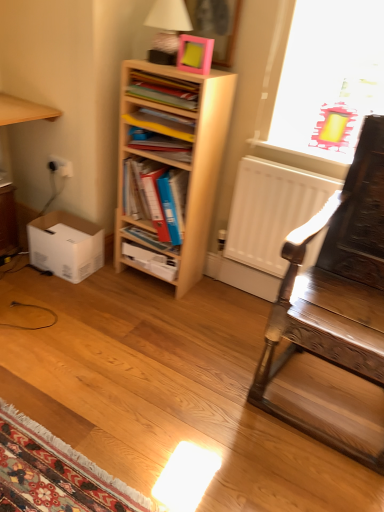
You are a GUI agent. You are given a task and a screenshot of the screen. Output one action in this format:
    pyautogui.click(x=<x>, y=<y>)
    Task: Click on the free spot below dark brown polished wood chair at right (from a real-world perspective)
    The image size is (384, 512).
    Given the screenshot: What is the action you would take?
    pyautogui.click(x=333, y=407)